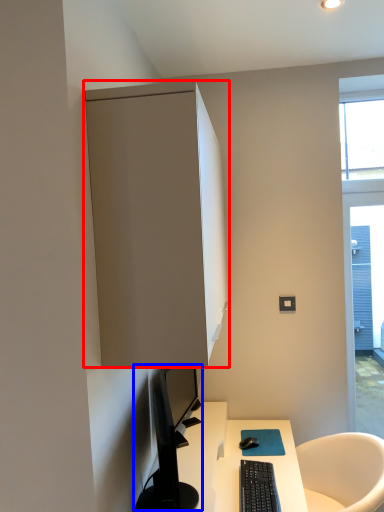
Question: Which point is further to the camera, cabinetry (highlighted by a red box) or computer monitor (highlighted by a blue box)?

Choices:
 (A) cabinetry
 (B) computer monitor

Answer: (B)